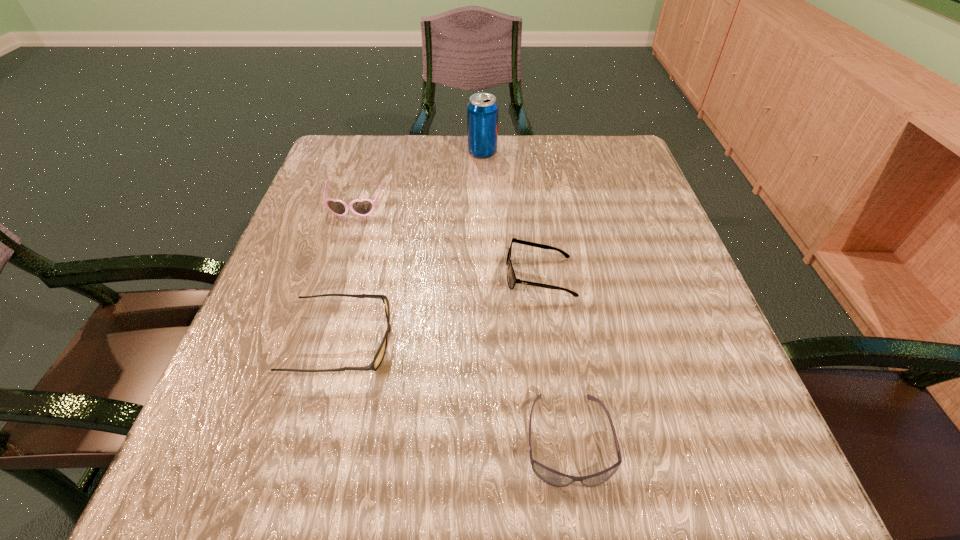
You are a GUI agent. You are given a task and a screenshot of the screen. Output one action in this format:
    pyautogui.click(x=<x>, y=<y>)
    Task: Click on the free space located 0.140m on the front-facing side of the third nearest sunglasses
    This screenshot has width=960, height=540.
    Given the screenshot: What is the action you would take?
    pyautogui.click(x=427, y=275)

Identify the location of vacant area situated 0.330m on the front-facing side of the third farthest sunglasses. (607, 342).

Where is `object present at the far edge`? This screenshot has width=960, height=540. object present at the far edge is located at coordinates (482, 110).

The height and width of the screenshot is (540, 960). What are the coordinates of `object situated at the near edge` in the screenshot? It's located at (552, 477).

The height and width of the screenshot is (540, 960). In order to click on free space at the far edge of the desktop in this screenshot , I will do [x=418, y=134].

I want to click on free space at the near edge of the desktop, so click(x=321, y=471).

Where is `vacant space at the left edge`? This screenshot has width=960, height=540. vacant space at the left edge is located at coordinates (316, 225).

I want to click on vacant space at the right edge of the desktop, so click(x=602, y=250).

Where is `free space at the far left corner`? free space at the far left corner is located at coordinates (355, 149).

In the image, there is a desktop. At what (x,y) coordinates should I click in order to perform the action: click on vacant space at the near left corner. Please return your answer as a coordinate pair (x, y). Looking at the image, I should click on 306,504.